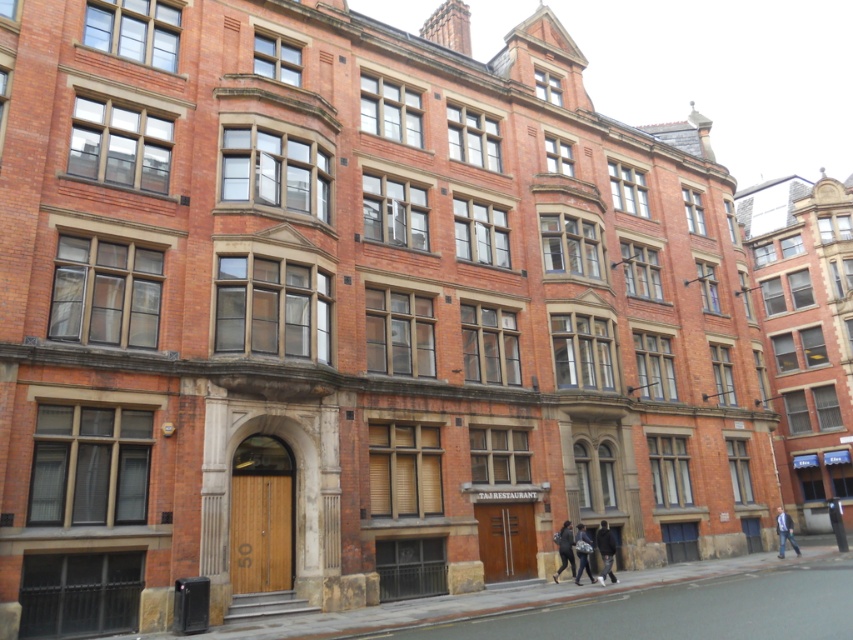
You are a tailor who needs to measure the distance between two jackets to ensure proper storage. The jackets are the dark gray fabric jacket at center and the dark gray fabric jacket at lower center. Can you fit a 16 inch wide box between them?

The distance between the dark gray fabric jacket at center and the dark gray fabric jacket at lower center is 15.92 inches. Since the box is 16 inches wide, it will not fit between them as the space is slightly narrower.

Consider the image. You see two jackets at the lower right of the image. Which one is positioned to the left between the dark gray fabric jacket at lower right and the blue denim jacket at lower right?

The dark gray fabric jacket at lower right is positioned to the left of the blue denim jacket at lower right.